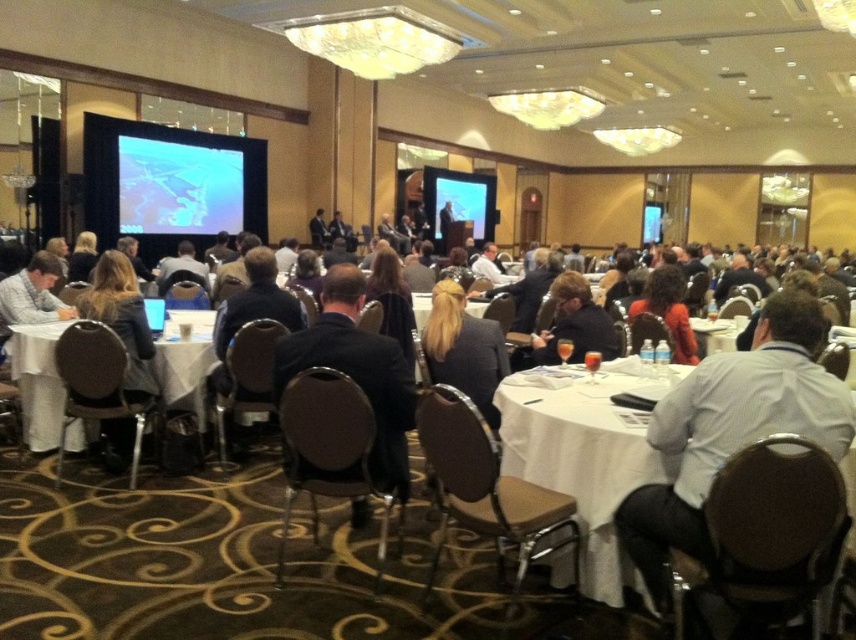
You are standing in the conference room and want to move from the point at coordinates point(x=21, y=348) to the point at coordinates point(x=663, y=288). Which direction should you move to get closer to your destination?

To move from point(x=21, y=348) to point(x=663, y=288), you should move upward and to the left because point(x=663, y=288) is located in that direction relative to point(x=21, y=348).

You are a guest entering the conference room and need to sit at the white cloth table at lower left. There is a dark brown leather jacket at center blocking your path. Can you walk directly to the table without moving the jacket?

The white cloth table at lower left is further to the viewer than the dark brown leather jacket at center, so the jacket is closer to you. Therefore, you would need to move the jacket out of the way to reach the table directly.

You are standing in the conference room and want to move from the point at coordinates point (198, 412) to the point at coordinates point (602, 323). Can you walk directly between them without any obstacles?

Point (198, 412) is behind point (602, 323), so you cannot walk directly between them without passing behind the point at (602, 323).